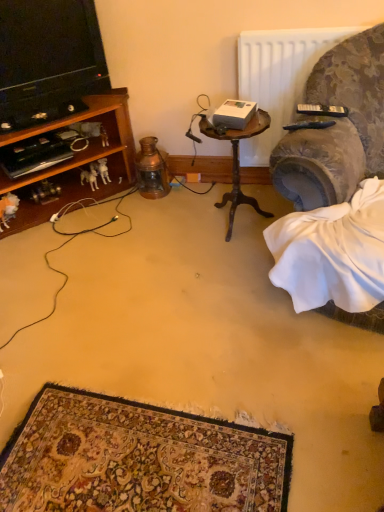
Identify the location of unoccupied region to the right of black cable at left. This screenshot has height=512, width=384. (183, 262).